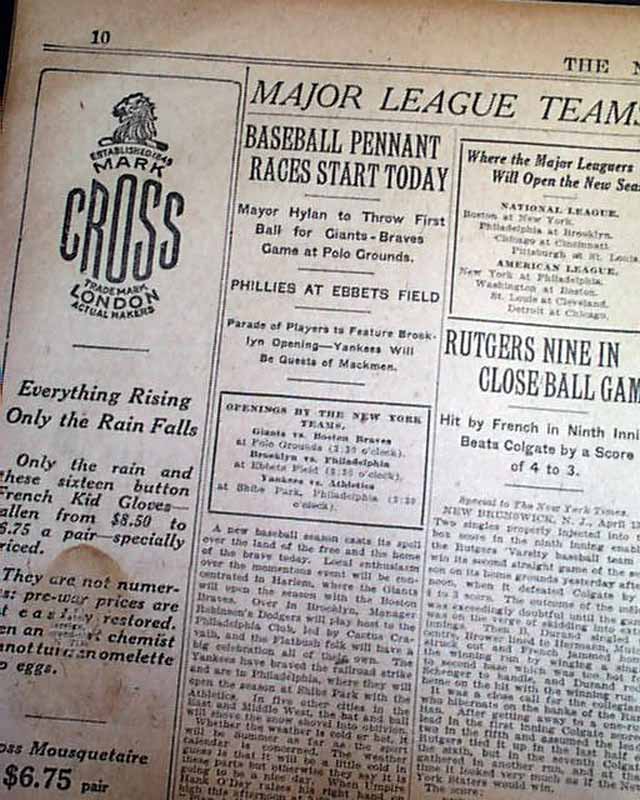
This screenshot has height=800, width=640. In order to click on newspaper in this screenshot , I will do click(349, 482).